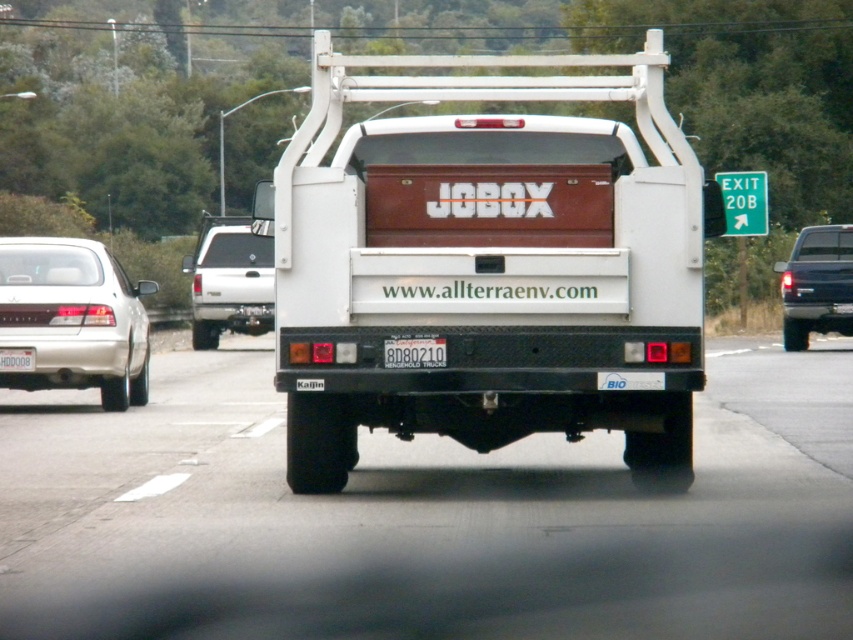
You are a traffic officer checking license plate dimensions. The regulations state that the license plate must be at least 12 inches wide. You observe the black plastic license plate at center and the white plastic license plate at center on a truck. Which license plate is narrower than the required minimum width?

The black plastic license plate at center has a lesser width compared to the white plastic license plate at center. Since the regulation requires a minimum of 12 inches, we need to determine if either meets this. However, the description only states their relative sizes. Without specific measurements, we can only confirm that the black plastic license plate at center is narrower than the white one, but it is unclear if it meets the 12 inch requirement.